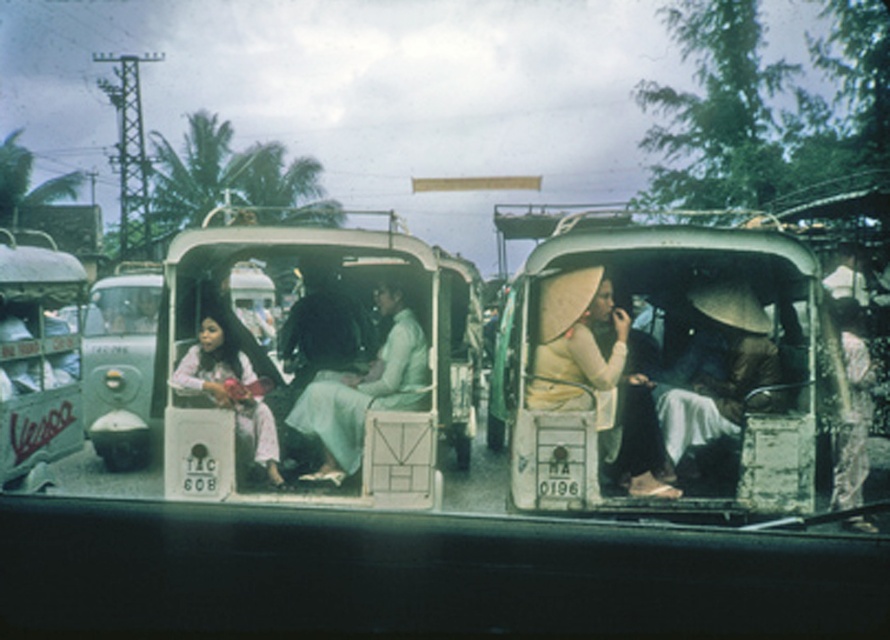
Based on the photo, you are a photographer standing in front of the scene. You want to take a photo of the brushed metal vespa at left and the light pink fabric at left. The minimum distance between them should be 5 feet to fit both in the frame. Can you capture them in one photo?

The brushed metal vespa at left and light pink fabric at left are 5.18 feet apart, so yes, the photographer can capture both in one photo since the distance between them is just over 5 feet.

You are a tourist trying to locate two specific items in the scene. The first is a light pink fabric at left, and the second is a yellow fabric hat at center. From the perspective of the camera, which item is positioned to the right?

The yellow fabric hat at center is to the right of the light pink fabric at left.

You are a photographer standing on the street and want to take a photo of the yellow fabric hat at center and the brushed metal vespa at left. Which object will appear larger in the photo?

The brushed metal vespa at left will appear larger in the photo because it is taller than the yellow fabric hat at center.